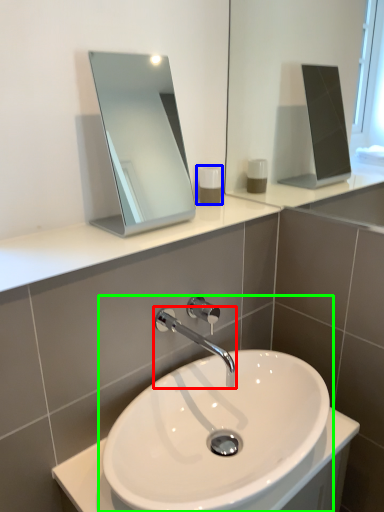
Question: Which is farther away from tap (highlighted by a red box)? soap dispenser (highlighted by a blue box) or sink (highlighted by a green box)?

Choices:
 (A) soap dispenser
 (B) sink

Answer: (A)